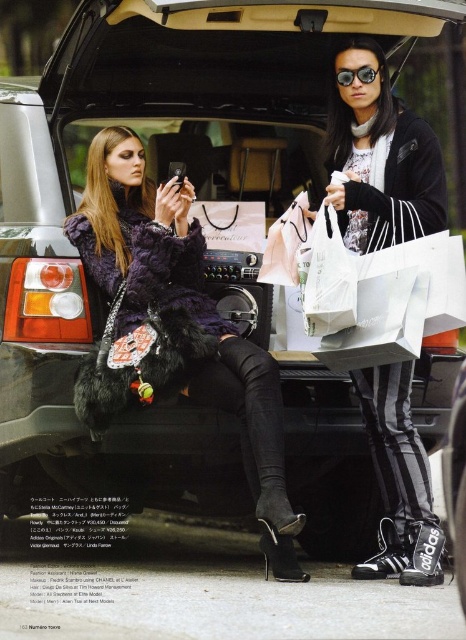
In the scene shown: Does fuzzy black coat at center appear under matte black goggles at upper center?

Correct, fuzzy black coat at center is located below matte black goggles at upper center.

The image size is (466, 640). Identify the location of fuzzy black coat at center. (173, 326).

Who is more forward, (287, 502) or (342, 68)?

Point (287, 502) is in front.

The height and width of the screenshot is (640, 466). In order to click on fuzzy black coat at center in this screenshot , I will do `click(173, 326)`.

How much distance is there between fuzzy black coat at center and black adidas sneakers at lower right?

A distance of 13.94 feet exists between fuzzy black coat at center and black adidas sneakers at lower right.

Does fuzzy black coat at center appear on the left side of black adidas sneakers at lower right?

Indeed, fuzzy black coat at center is positioned on the left side of black adidas sneakers at lower right.

Between point (172, 220) and point (378, 81), which one is positioned behind?

The point (378, 81) is more distant.

The image size is (466, 640). I want to click on fuzzy black coat at center, so click(173, 326).

Can you confirm if black adidas sneakers at lower right is taller than matte black goggles at upper center?

Yes, black adidas sneakers at lower right is taller than matte black goggles at upper center.

At what (x,y) coordinates should I click in order to perform the action: click on black adidas sneakers at lower right. Please return your answer as a coordinate pair (x, y). This screenshot has height=640, width=466. Looking at the image, I should click on (381, 160).